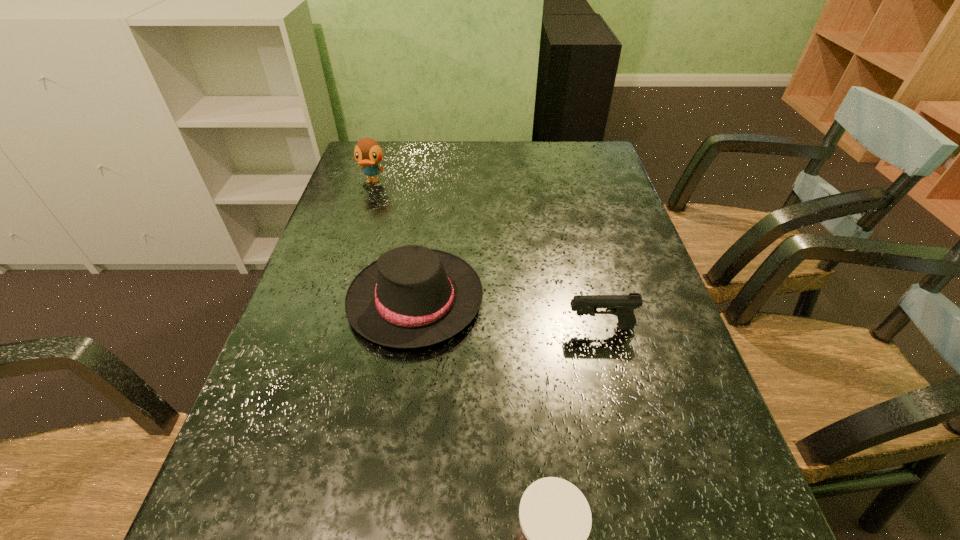
Identify the location of duck situated at the left edge. The image size is (960, 540). (368, 153).

Locate an element on the screen. The image size is (960, 540). dress hat located at the left edge is located at coordinates (412, 296).

Where is `object located at the right edge`? Image resolution: width=960 pixels, height=540 pixels. object located at the right edge is located at coordinates (622, 306).

Where is `object situated at the far left corner`? This screenshot has height=540, width=960. object situated at the far left corner is located at coordinates (368, 153).

Find the location of a particular element. The image size is (960, 540). vacant space at the far edge of the desktop is located at coordinates (427, 165).

In the image, there is a desktop. What are the coordinates of `vacant space at the left edge` in the screenshot? It's located at (318, 245).

Where is `vacant space at the right edge`? The width and height of the screenshot is (960, 540). vacant space at the right edge is located at coordinates (676, 324).

I want to click on vacant space at the far left corner of the desktop, so click(390, 141).

Locate an element on the screen. free space that is in between the dress hat and the farthest object is located at coordinates (394, 241).

Locate an element on the screen. free spot between the dress hat and the farthest object is located at coordinates (394, 241).